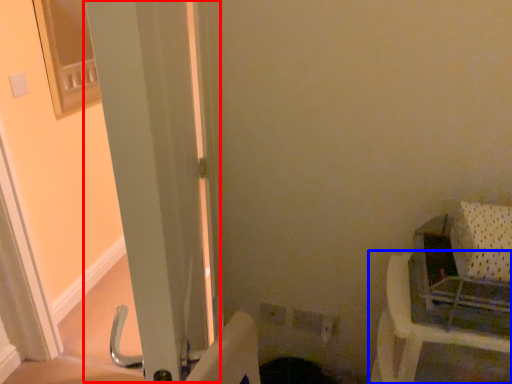
Question: Which object is closer to the camera taking this photo, screen door (highlighted by a red box) or furniture (highlighted by a blue box)?

Choices:
 (A) screen door
 (B) furniture

Answer: (A)